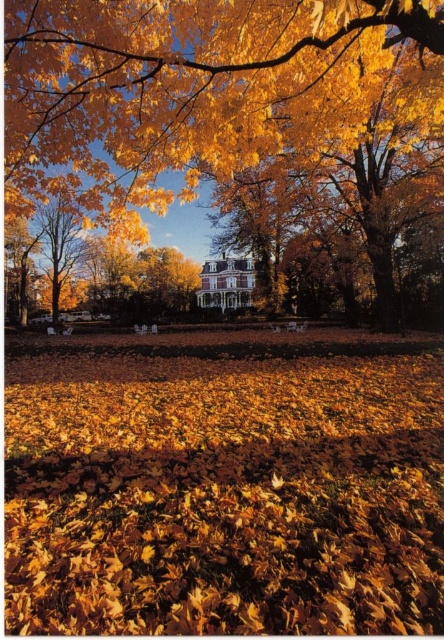
Is point (373, 342) in front of point (162, 161)?

No, it is behind (162, 161).

Is shiny golden leaves at center wider than golden textured leaves at center?

Incorrect, shiny golden leaves at center's width does not surpass golden textured leaves at center's.

This screenshot has height=640, width=444. I want to click on shiny golden leaves at center, so click(x=225, y=492).